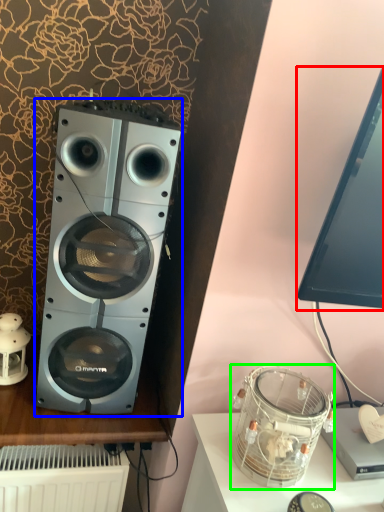
Question: Which object is positioned closest to computer monitor (highlighted by a red box)? Select from home appliance (highlighted by a blue box) and appliance (highlighted by a green box).

Choices:
 (A) home appliance
 (B) appliance

Answer: (B)